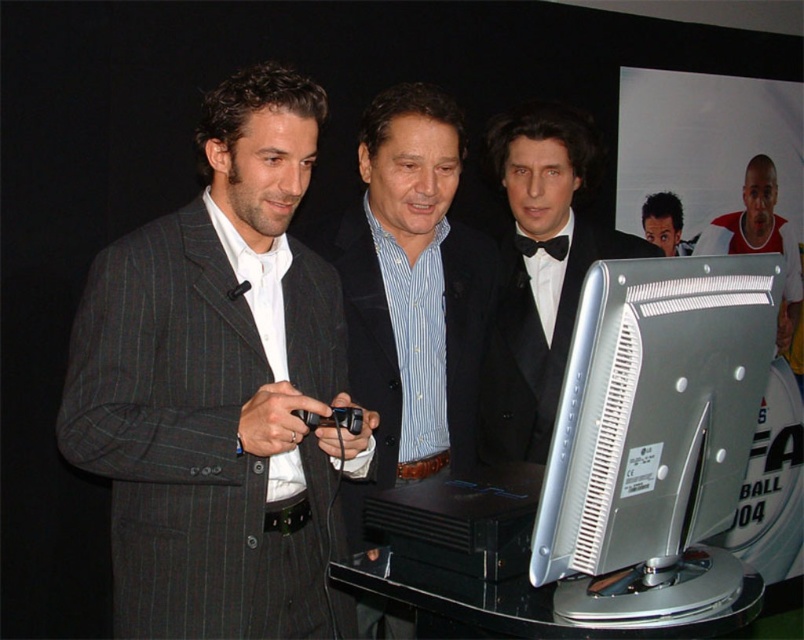
Question: Estimate the real-world distances between objects in this image. Which object is closer to the dark brown hair at center?

Choices:
 (A) black satin tuxedo at right
 (B) blue striped shirt at center
 (C) gray pinstripe suit at left

Answer: (A)

Question: Is gray pinstripe suit at left closer to the viewer compared to silver metallic computer monitor at right?

Choices:
 (A) no
 (B) yes

Answer: (A)

Question: Which point is closer to the camera?

Choices:
 (A) gray pinstripe suit at left
 (B) dark brown hair at center

Answer: (A)

Question: Which point is farther from the camera taking this photo?

Choices:
 (A) (417, 300)
 (B) (528, 445)
 (C) (232, 545)

Answer: (B)

Question: Can you confirm if blue striped shirt at center is wider than dark brown hair at center?

Choices:
 (A) no
 (B) yes

Answer: (B)

Question: Is white/red t-shirt at right behind dark brown hair at center?

Choices:
 (A) no
 (B) yes

Answer: (B)